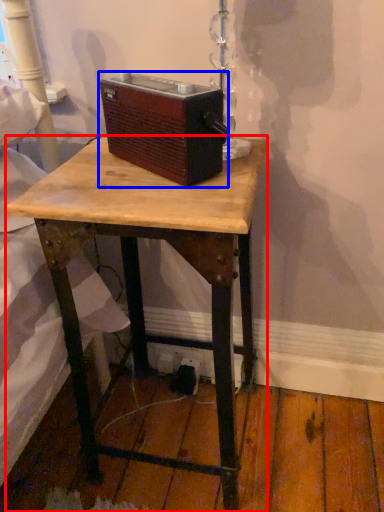
Question: Which point is further to the camera, desk (highlighted by a red box) or gadget (highlighted by a blue box)?

Choices:
 (A) desk
 (B) gadget

Answer: (B)